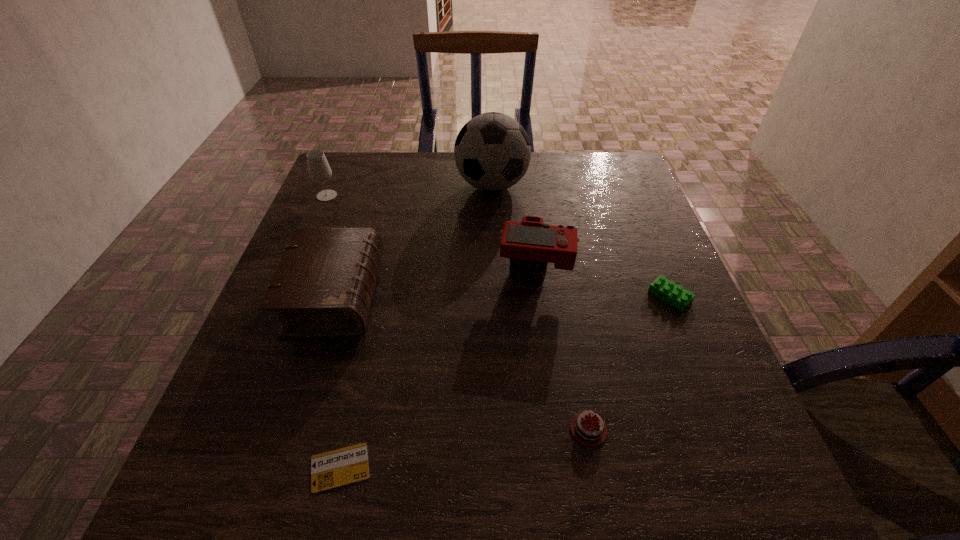
Image resolution: width=960 pixels, height=540 pixels. Find the location of `the tallest object`. the tallest object is located at coordinates (492, 151).

The height and width of the screenshot is (540, 960). I want to click on glass, so click(319, 170).

Locate an element on the screen. The width and height of the screenshot is (960, 540). camera is located at coordinates (530, 243).

The height and width of the screenshot is (540, 960). In order to click on the fourth shortest object in this screenshot , I will do `click(322, 288)`.

Where is `chocolate cake`? Image resolution: width=960 pixels, height=540 pixels. chocolate cake is located at coordinates pyautogui.click(x=586, y=430).

Identify the location of Lego. This screenshot has width=960, height=540. (675, 295).

In order to click on the shortest object in this screenshot , I will do `click(340, 467)`.

This screenshot has width=960, height=540. In order to click on vacant area situated 0.260m on the main logo of the soccer ball in this screenshot , I will do `click(495, 276)`.

What are the coordinates of `free location located on the right of the glass` in the screenshot? It's located at (407, 195).

The image size is (960, 540). I want to click on blank space located 0.150m on the right of the camera, so click(639, 273).